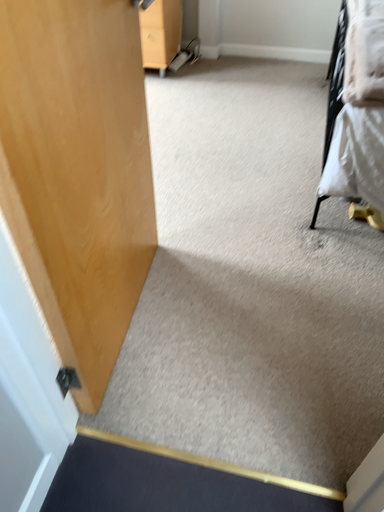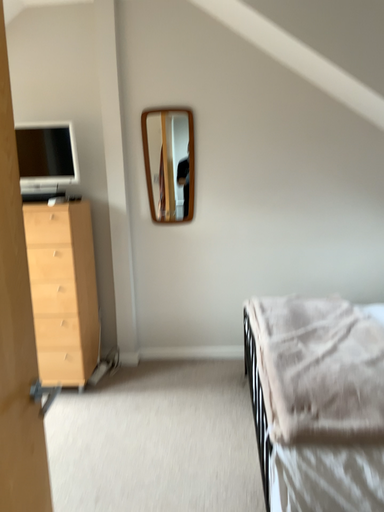
Question: Which way did the camera rotate in the video?

Choices:
 (A) rotated right
 (B) rotated left

Answer: (A)